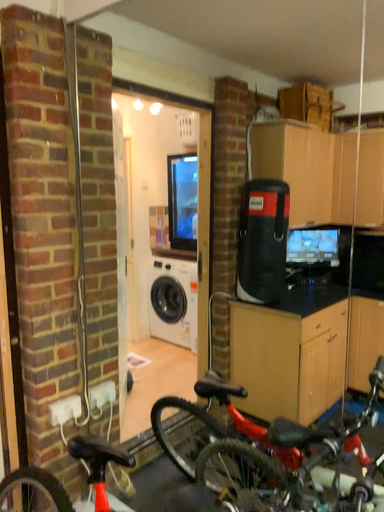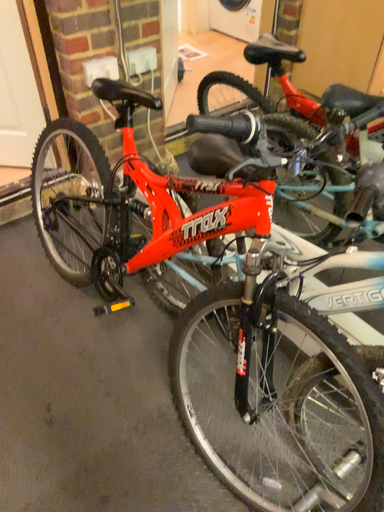
Question: Which way did the camera rotate in the video?

Choices:
 (A) rotated upward
 (B) rotated downward

Answer: (B)